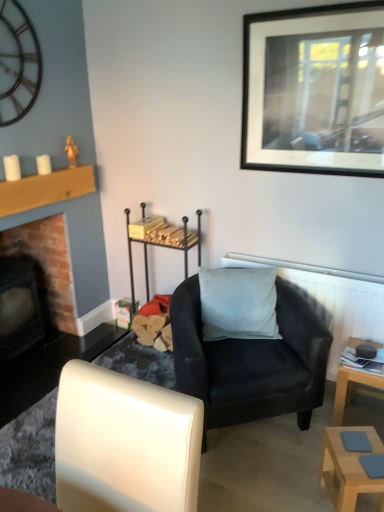
Question: Can you confirm if matte black armchair at center, the first chair positioned from the back, is bigger than white leather chair at lower left, the first chair viewed from the front?

Choices:
 (A) yes
 (B) no

Answer: (A)

Question: Is matte black armchair at center, the 2th chair positioned from the front, at the right side of white leather chair at lower left, the first chair viewed from the front?

Choices:
 (A) no
 (B) yes

Answer: (B)

Question: Can you confirm if matte black armchair at center, the first chair positioned from the back, is shorter than white leather chair at lower left, the 2th chair when ordered from back to front?

Choices:
 (A) yes
 (B) no

Answer: (B)

Question: Is matte black armchair at center, the first chair positioned from the back, smaller than white leather chair at lower left, the first chair viewed from the front?

Choices:
 (A) yes
 (B) no

Answer: (B)

Question: Would you say matte black armchair at center, the first chair positioned from the back, is a long distance from white leather chair at lower left, the 2th chair when ordered from back to front?

Choices:
 (A) yes
 (B) no

Answer: (B)

Question: From a real-world perspective, is light wood table at lower right, positioned as the first table in front-to-back order, above or below white textured radiator at upper right?

Choices:
 (A) below
 (B) above

Answer: (A)

Question: In the image, is light wood table at lower right, positioned as the first table in front-to-back order, positioned in front of or behind white textured radiator at upper right?

Choices:
 (A) front
 (B) behind

Answer: (A)

Question: Is light wood table at lower right, positioned as the first table in front-to-back order, bigger or smaller than white textured radiator at upper right?

Choices:
 (A) big
 (B) small

Answer: (B)

Question: Which is correct: light wood table at lower right, positioned as the first table in front-to-back order, is inside white textured radiator at upper right, or outside of it?

Choices:
 (A) outside
 (B) inside

Answer: (A)

Question: Considering the relative positions of black matte picture frame at upper right and suede-like gray pillow at center in the image provided, is black matte picture frame at upper right to the left or to the right of suede-like gray pillow at center?

Choices:
 (A) right
 (B) left

Answer: (A)

Question: Looking at their shapes, would you say black matte picture frame at upper right is wider or thinner than suede-like gray pillow at center?

Choices:
 (A) thin
 (B) wide

Answer: (A)

Question: Is black matte picture frame at upper right bigger or smaller than suede-like gray pillow at center?

Choices:
 (A) big
 (B) small

Answer: (B)

Question: Considering the positions of black matte picture frame at upper right and suede-like gray pillow at center in the image, is black matte picture frame at upper right taller or shorter than suede-like gray pillow at center?

Choices:
 (A) short
 (B) tall

Answer: (B)

Question: Based on their positions, is white leather chair at lower left, the first chair viewed from the front, located to the left or right of light wood table at lower right, the 2th table when ordered from back to front?

Choices:
 (A) right
 (B) left

Answer: (B)

Question: From the image's perspective, is white leather chair at lower left, the first chair viewed from the front, positioned above or below light wood table at lower right, positioned as the first table in front-to-back order?

Choices:
 (A) above
 (B) below

Answer: (A)